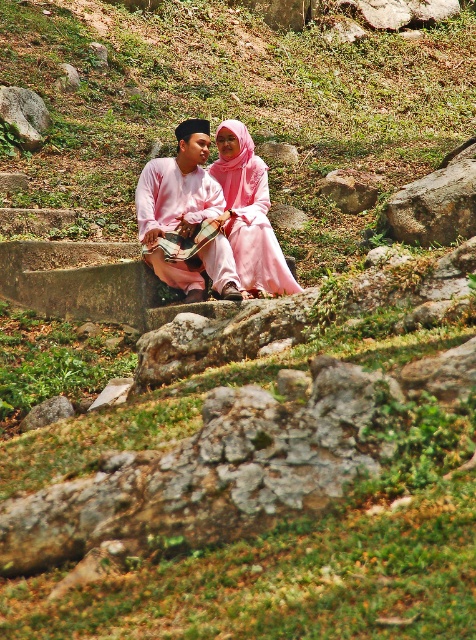
Question: Is pink satin dress at center positioned behind gray rough rock at upper left?

Choices:
 (A) yes
 (B) no

Answer: (B)

Question: Does pink satin dress at center appear on the left side of gray rough rock at upper left?

Choices:
 (A) yes
 (B) no

Answer: (B)

Question: Which is nearer to the matte pink clothing at center?

Choices:
 (A) smooth gray rock at center
 (B) gray rough rock at upper left

Answer: (A)

Question: Which of the following is the closest to the observer?

Choices:
 (A) (357, 177)
 (B) (179, 268)
 (C) (251, 208)
 (D) (7, 108)

Answer: (B)

Question: Does matte pink clothing at center appear on the right side of gray rough rock at upper left?

Choices:
 (A) yes
 (B) no

Answer: (A)

Question: Which of the following is the closest to the observer?

Choices:
 (A) pink satin dress at center
 (B) matte pink clothing at center
 (C) gray rough rock at upper left

Answer: (B)